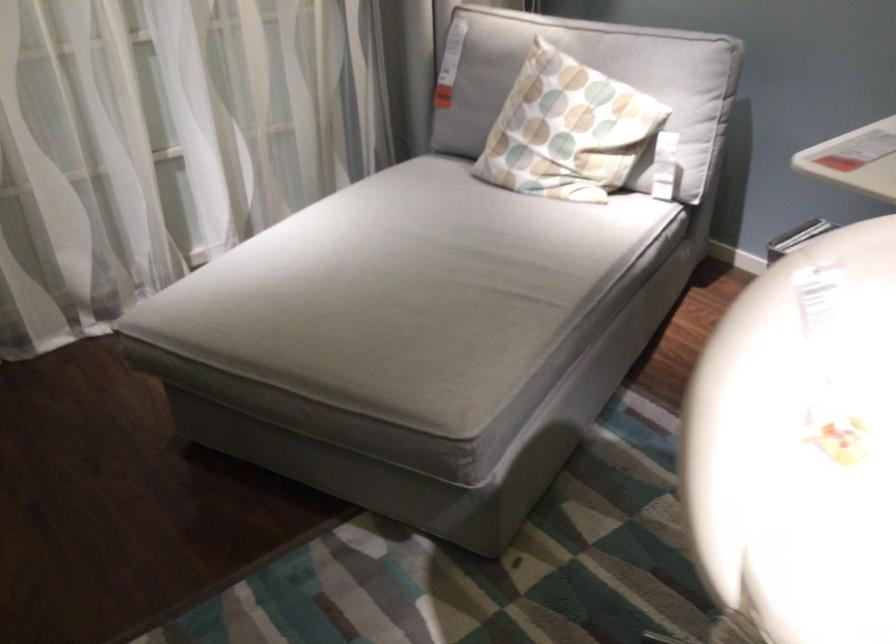
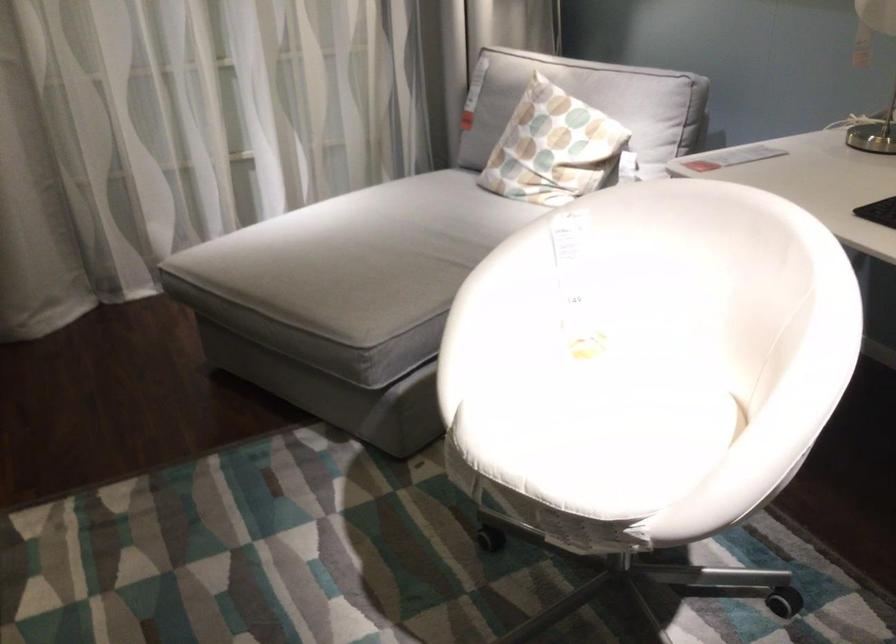
Where in the second image is the point corresponding to (576,131) from the first image?

(553, 147)